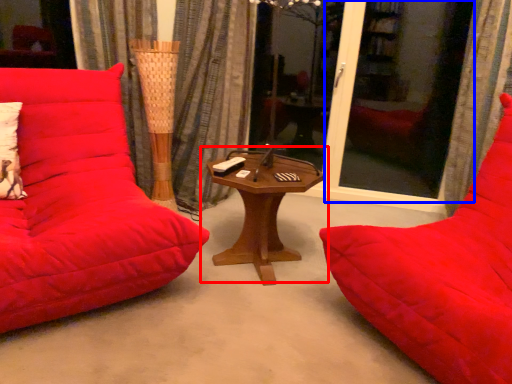
Question: Which object is closer to the camera taking this photo, table (highlighted by a red box) or screen door (highlighted by a blue box)?

Choices:
 (A) table
 (B) screen door

Answer: (A)